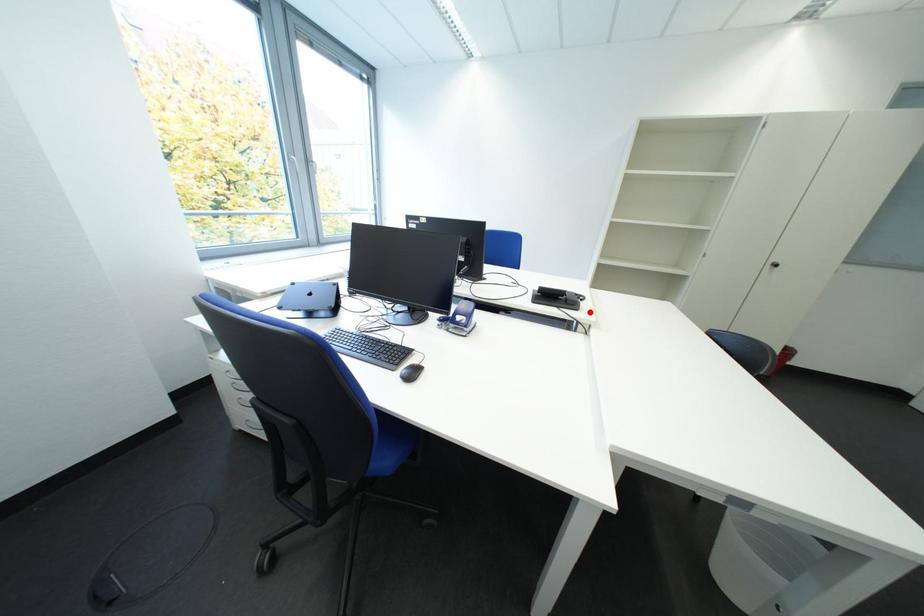
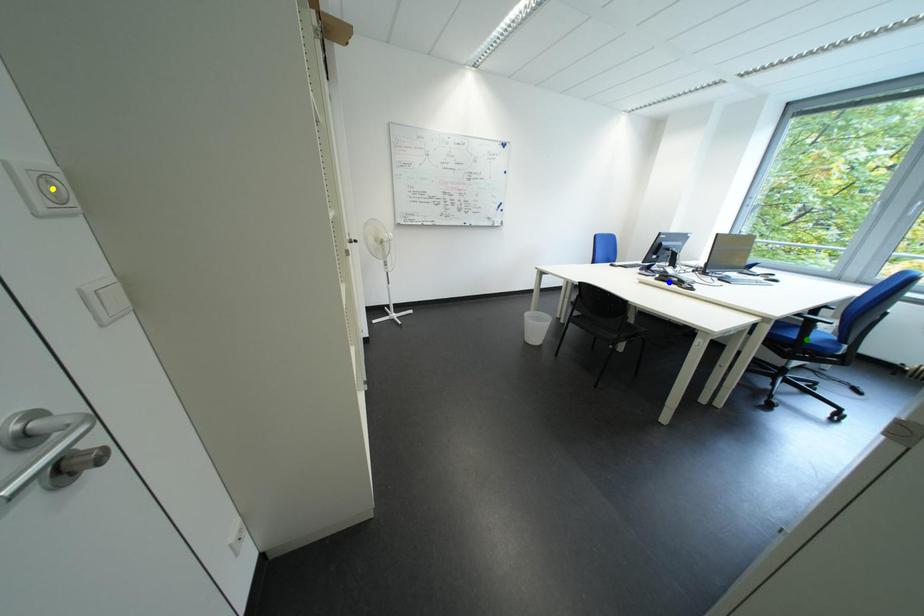
Question: I am providing you with two images of the same scene from different viewpoints. A red point is marked on the first image. You are given multiple points on the second image. In image 2, which mark is for the same physical point as the one in image 1?

Choices:
 (A) yellow point
 (B) green point
 (C) blue point

Answer: (C)